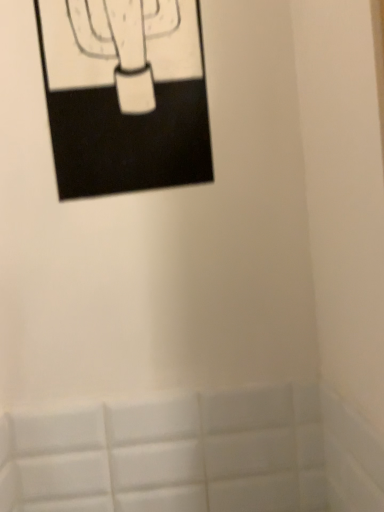
Measure the distance between white matte tile at lower center and camera.

A distance of 66.63 centimeters exists between white matte tile at lower center and camera.

This screenshot has width=384, height=512. Describe the element at coordinates (194, 454) in the screenshot. I see `white matte tile at lower center` at that location.

The width and height of the screenshot is (384, 512). Find the location of `white matte tile at lower center`. white matte tile at lower center is located at coordinates (194, 454).

Identify the location of black matte picture frame at upper left. (125, 94).

Describe the element at coordinates (125, 94) in the screenshot. I see `black matte picture frame at upper left` at that location.

At what (x,y) coordinates should I click in order to perform the action: click on white matte tile at lower center. Please return your answer as a coordinate pair (x, y). Looking at the image, I should click on (194, 454).

Is white matte tile at lower center at the right side of black matte picture frame at upper left?

Yes, white matte tile at lower center is to the right of black matte picture frame at upper left.

Does white matte tile at lower center come behind black matte picture frame at upper left?

That is True.

Is point (281, 411) less distant than point (120, 153)?

That is False.

Looking at this image, from the image's perspective, is white matte tile at lower center on black matte picture frame at upper left?

Actually, white matte tile at lower center appears below black matte picture frame at upper left in the image.

From a real-world perspective, who is located higher, white matte tile at lower center or black matte picture frame at upper left?

In real-world perspective, black matte picture frame at upper left is above.

In terms of width, does white matte tile at lower center look wider or thinner when compared to black matte picture frame at upper left?

white matte tile at lower center is thinner than black matte picture frame at upper left.

Does white matte tile at lower center have a lesser height compared to black matte picture frame at upper left?

Yes, white matte tile at lower center is shorter than black matte picture frame at upper left.

Who is bigger, white matte tile at lower center or black matte picture frame at upper left?

black matte picture frame at upper left.

Is white matte tile at lower center positioned beyond the bounds of black matte picture frame at upper left?

Yes, white matte tile at lower center is located beyond the bounds of black matte picture frame at upper left.

Is there a large distance between white matte tile at lower center and black matte picture frame at upper left?

Actually, white matte tile at lower center and black matte picture frame at upper left are a little close together.

Is white matte tile at lower center positioned with its back to black matte picture frame at upper left?

No, white matte tile at lower center is not facing away from black matte picture frame at upper left.

What's the angular difference between white matte tile at lower center and black matte picture frame at upper left's facing directions?

There is a 2.38-degree angle between the facing directions of white matte tile at lower center and black matte picture frame at upper left.

This screenshot has width=384, height=512. In order to click on picture frame on the left of white matte tile at lower center in this screenshot , I will do `click(125, 94)`.

Considering the positions of objects black matte picture frame at upper left and white matte tile at lower center in the image provided, who is more to the right, black matte picture frame at upper left or white matte tile at lower center?

white matte tile at lower center.

Which object is further away from the camera, black matte picture frame at upper left or white matte tile at lower center?

white matte tile at lower center is behind.

Does point (127, 175) appear closer or farther from the camera than point (316, 445)?

Point (127, 175) is positioned closer to the camera compared to point (316, 445).

From the image's perspective, is black matte picture frame at upper left beneath white matte tile at lower center?

No.

From a real-world perspective, is black matte picture frame at upper left on white matte tile at lower center?

Yes, from a real-world perspective, black matte picture frame at upper left is above white matte tile at lower center.

Between black matte picture frame at upper left and white matte tile at lower center, which one has smaller width?

white matte tile at lower center.

Who is shorter, black matte picture frame at upper left or white matte tile at lower center?

With less height is white matte tile at lower center.

Does black matte picture frame at upper left have a larger size compared to white matte tile at lower center?

Yes.

Is black matte picture frame at upper left not within white matte tile at lower center?

Absolutely, black matte picture frame at upper left is external to white matte tile at lower center.

Is black matte picture frame at upper left placed right next to white matte tile at lower center?

black matte picture frame at upper left and white matte tile at lower center are not in contact.

Is black matte picture frame at upper left facing away from white matte tile at lower center?

Answer: black matte picture frame at upper left does not have its back to white matte tile at lower center.

How many degrees apart are the facing directions of black matte picture frame at upper left and white matte tile at lower center?

2.38 degrees separate the facing orientations of black matte picture frame at upper left and white matte tile at lower center.

The height and width of the screenshot is (512, 384). Find the location of `picture frame lying on the left of white matte tile at lower center`. picture frame lying on the left of white matte tile at lower center is located at coordinates (125, 94).

You are a GUI agent. You are given a task and a screenshot of the screen. Output one action in this format:
    pyautogui.click(x=<x>, y=<y>)
    Task: Click on the picture frame on the left of white matte tile at lower center
    
    Given the screenshot: What is the action you would take?
    pyautogui.click(x=125, y=94)

You are a GUI agent. You are given a task and a screenshot of the screen. Output one action in this format:
    pyautogui.click(x=<x>, y=<y>)
    Task: Click on the picture frame above the white matte tile at lower center (from a real-world perspective)
    
    Given the screenshot: What is the action you would take?
    pyautogui.click(x=125, y=94)